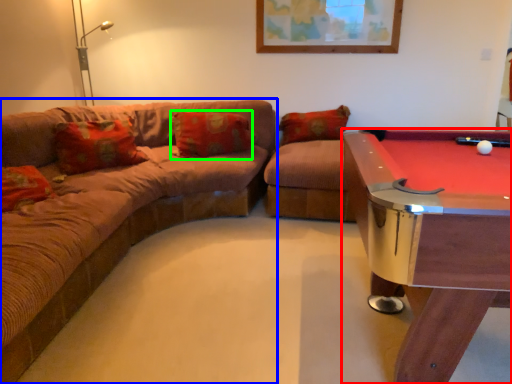
Question: Which object is the farthest from billiard table (highlighted by a red box)? Choose among these: studio couch (highlighted by a blue box) or pillow (highlighted by a green box).

Choices:
 (A) studio couch
 (B) pillow

Answer: (B)